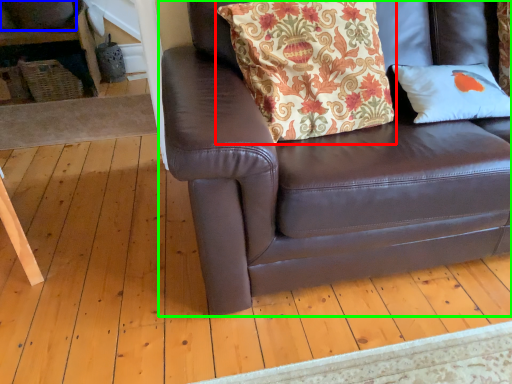
Question: Considering the real-world distances, which object is closest to pillow (highlighted by a red box)? gray (highlighted by a blue box) or studio couch (highlighted by a green box).

Choices:
 (A) gray
 (B) studio couch

Answer: (B)